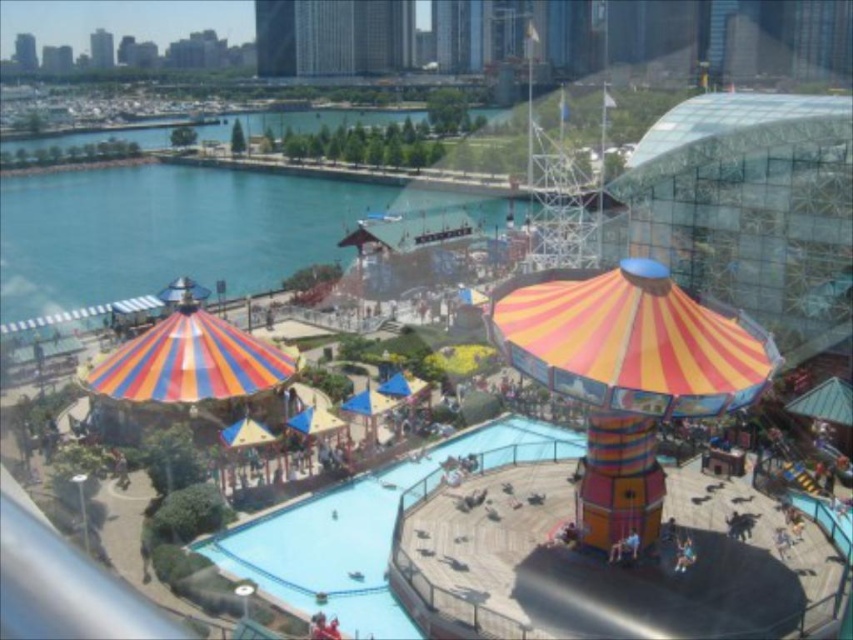
You are standing at the elevated vantage point looking down at the amusement park. Which object is closer to you between the blue wooden pool at center and the blue water at center?

The blue wooden pool at center is closer to you because it is in front of the blue water at center.

You are standing at the edge of the blue wooden pool at center and want to reach the blue water at center. Which direction should you move to get there?

You should move to the left because the blue wooden pool at center is to the right of the blue water at center.

You are standing at the window looking at the amusement park scene. There is a point marked at coordinates (404, 483) in the image. If you were to throw a small ball from your current position, would it land near that point? Please explain your reasoning.

The point at coordinates (404, 483) is 8.55 meters away from the viewer. Since the distance is relatively far, it would be challenging to accurately throw a ball from your current position and have it land near that point without precise aim and sufficient force.